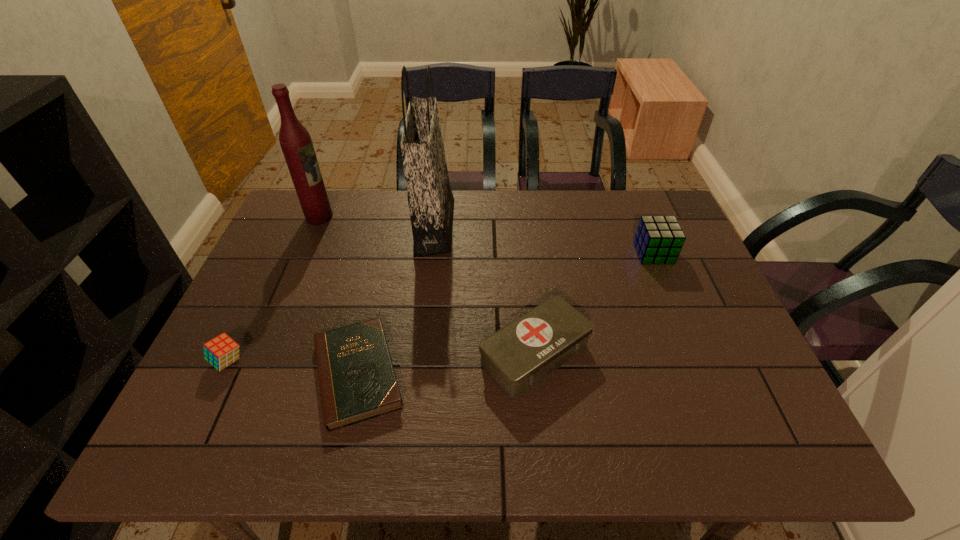
Where is `vacant region between the shorter cube and the shopping bag`? vacant region between the shorter cube and the shopping bag is located at coordinates 331,294.

The image size is (960, 540). In order to click on free spot between the nearer cube and the shortest object in this screenshot , I will do `click(293, 368)`.

You are a GUI agent. You are given a task and a screenshot of the screen. Output one action in this format:
    pyautogui.click(x=<x>, y=<y>)
    Task: Click on the free space between the rightmost object and the shopping bag
    The image size is (960, 540).
    Given the screenshot: What is the action you would take?
    pyautogui.click(x=543, y=240)

The image size is (960, 540). Identify the location of free space between the right cube and the left cube. (441, 307).

The image size is (960, 540). What are the coordinates of `vacant area that lies between the liquor and the shortest object` in the screenshot? It's located at (338, 295).

At what (x,y) coordinates should I click in order to perform the action: click on object that is the fifth closest one to the shopping bag. Please return your answer as a coordinate pair (x, y). Looking at the image, I should click on (658, 239).

Where is `object that is the second nearest to the right cube`? The height and width of the screenshot is (540, 960). object that is the second nearest to the right cube is located at coordinates click(431, 203).

You are a GUI agent. You are given a task and a screenshot of the screen. Output one action in this format:
    pyautogui.click(x=<x>, y=<y>)
    Task: Click on the vacant space that satisfies the following two spatial constraints: 1. on the front of the fifth object from left to right with the design; 2. on the left side of the shopping bag
    Image resolution: width=960 pixels, height=540 pixels.
    Given the screenshot: What is the action you would take?
    pyautogui.click(x=420, y=355)

Identify the location of vacant space that satisfies the following two spatial constraints: 1. on the front of the right cube with the design; 2. on the right side of the shopping bag. (431, 253).

Find the location of a particular element. This screenshot has height=540, width=960. vacant position in the image that satisfies the following two spatial constraints: 1. on the back side of the shortest object; 2. on the left side of the second object from right to left is located at coordinates (362, 355).